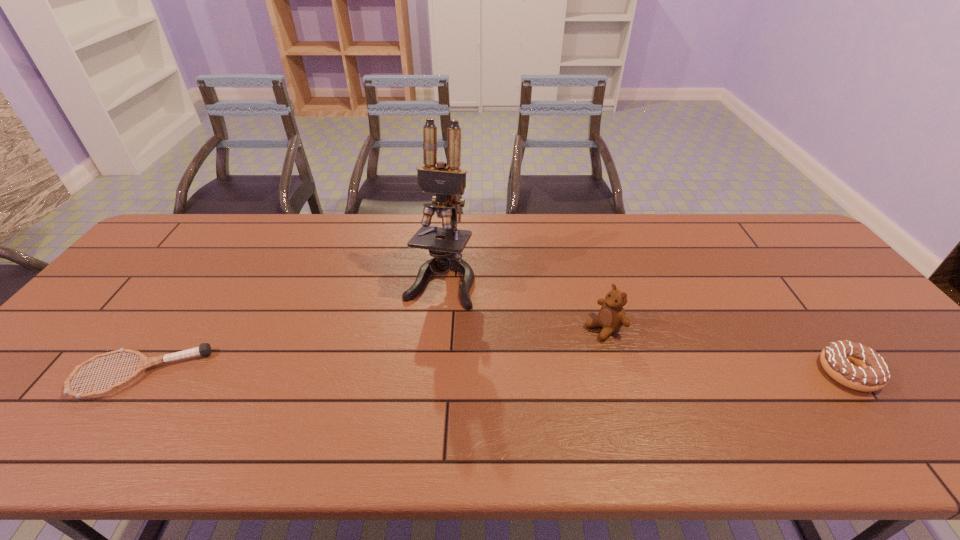
At what (x,y) coordinates should I click in order to perform the action: click on tennis racket. Please return your answer as a coordinate pair (x, y). The height and width of the screenshot is (540, 960). Looking at the image, I should click on (204, 349).

Image resolution: width=960 pixels, height=540 pixels. Find the location of `the leftmost object`. the leftmost object is located at coordinates (204, 349).

Where is `doughnut`? Image resolution: width=960 pixels, height=540 pixels. doughnut is located at coordinates (854, 365).

Locate an element on the screen. This screenshot has height=540, width=960. the second shortest object is located at coordinates (854, 365).

This screenshot has width=960, height=540. Find the location of `microscope`. microscope is located at coordinates (447, 180).

Where is `the farthest object`? The image size is (960, 540). the farthest object is located at coordinates (447, 180).

Identify the location of the third nearest object. The height and width of the screenshot is (540, 960). (611, 317).

Locate an element on the screen. the second tallest object is located at coordinates 611,317.

In order to click on free space located 0.320m on the back of the tennis racket in this screenshot , I will do `click(215, 267)`.

Where is `vacant space situated on the back of the second shortest object`? The image size is (960, 540). vacant space situated on the back of the second shortest object is located at coordinates (803, 313).